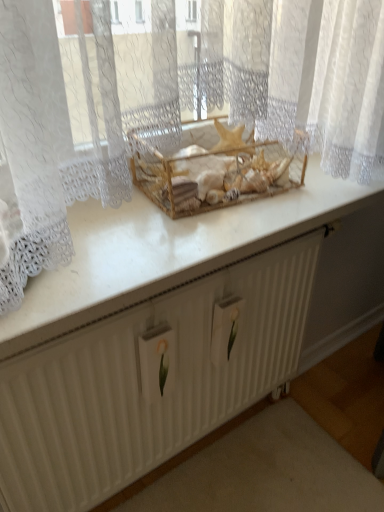
Question: From the image's perspective, would you say wooden crate at center is positioned over white glossy counter top at center?

Choices:
 (A) yes
 (B) no

Answer: (A)

Question: Is white glossy counter top at center completely or partially inside wooden crate at center?

Choices:
 (A) no
 (B) yes

Answer: (A)

Question: Is the depth of wooden crate at center less than that of white glossy counter top at center?

Choices:
 (A) no
 (B) yes

Answer: (A)

Question: Is wooden crate at center directly adjacent to white glossy counter top at center?

Choices:
 (A) yes
 (B) no

Answer: (B)

Question: Does wooden crate at center lie behind white glossy counter top at center?

Choices:
 (A) no
 (B) yes

Answer: (B)

Question: Would you say wooden crate at center is to the left or to the right of white glossy counter top at center in the picture?

Choices:
 (A) right
 (B) left

Answer: (A)

Question: Is wooden crate at center taller or shorter than white glossy counter top at center?

Choices:
 (A) short
 (B) tall

Answer: (B)

Question: Relative to white glossy counter top at center, is wooden crate at center in front or behind?

Choices:
 (A) front
 (B) behind

Answer: (B)

Question: From a real-world perspective, is wooden crate at center above or below white glossy counter top at center?

Choices:
 (A) above
 (B) below

Answer: (A)

Question: From a real-world perspective, is white textured radiator at center physically located above or below wooden crate at center?

Choices:
 (A) above
 (B) below

Answer: (B)

Question: In terms of height, does white textured radiator at center look taller or shorter compared to wooden crate at center?

Choices:
 (A) tall
 (B) short

Answer: (A)

Question: From the image's perspective, is white textured radiator at center positioned above or below wooden crate at center?

Choices:
 (A) below
 (B) above

Answer: (A)

Question: Looking at their shapes, would you say white textured radiator at center is wider or thinner than wooden crate at center?

Choices:
 (A) thin
 (B) wide

Answer: (A)

Question: Do you think white glossy counter top at center is within wooden crate at center, or outside of it?

Choices:
 (A) inside
 (B) outside

Answer: (B)

Question: From the image's perspective, relative to wooden crate at center, is white glossy counter top at center above or below?

Choices:
 (A) below
 (B) above

Answer: (A)